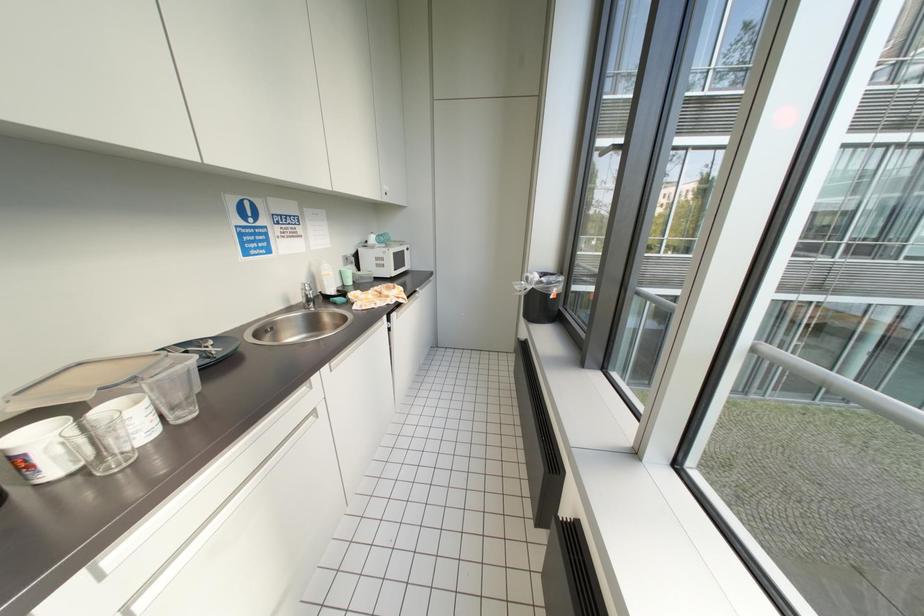
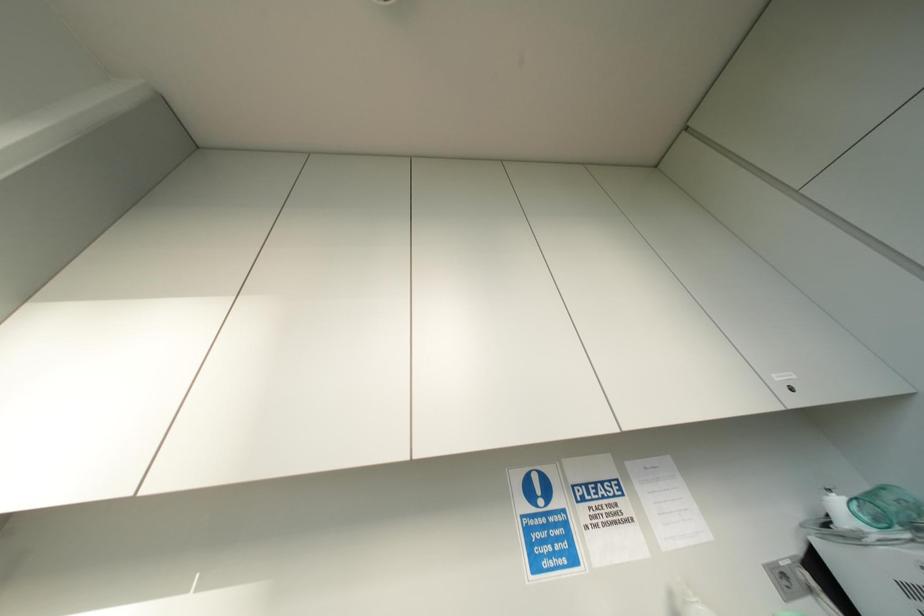
The first image is from the beginning of the video and the second image is from the end. How did the camera likely rotate when shooting the video?

The rotation direction of the camera is left-up.